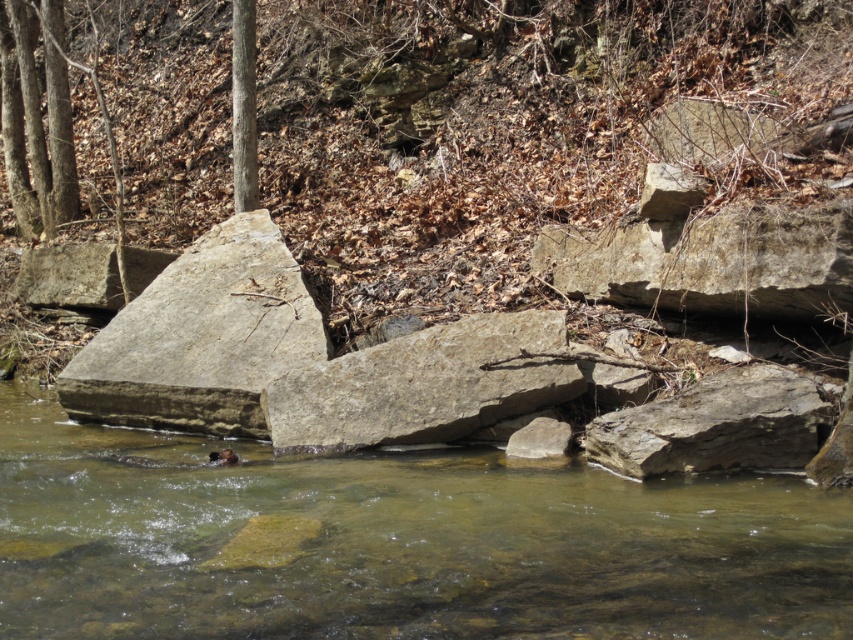
You are a hiker trying to cross the river using the rocks. You see the clear water at center and the gray rough stone at center. Which object is positioned higher in the scene?

The gray rough stone at center is positioned higher than the clear water at center, as the clear water at center is located below it.

You are standing at the edge of the stream and want to climb up to the brown rocky hillside at upper center. Based on the coordinates provided, is the hillside positioned to your left, right, or directly ahead?

The brown rocky hillside at upper center is located at coordinates point (521, 122), which places it directly ahead of your position at the stream edge.